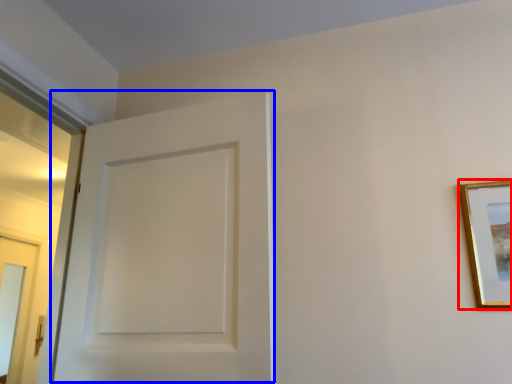
Question: Which object appears farthest to the camera in this image, picture frame (highlighted by a red box) or door (highlighted by a blue box)?

Choices:
 (A) picture frame
 (B) door

Answer: (A)